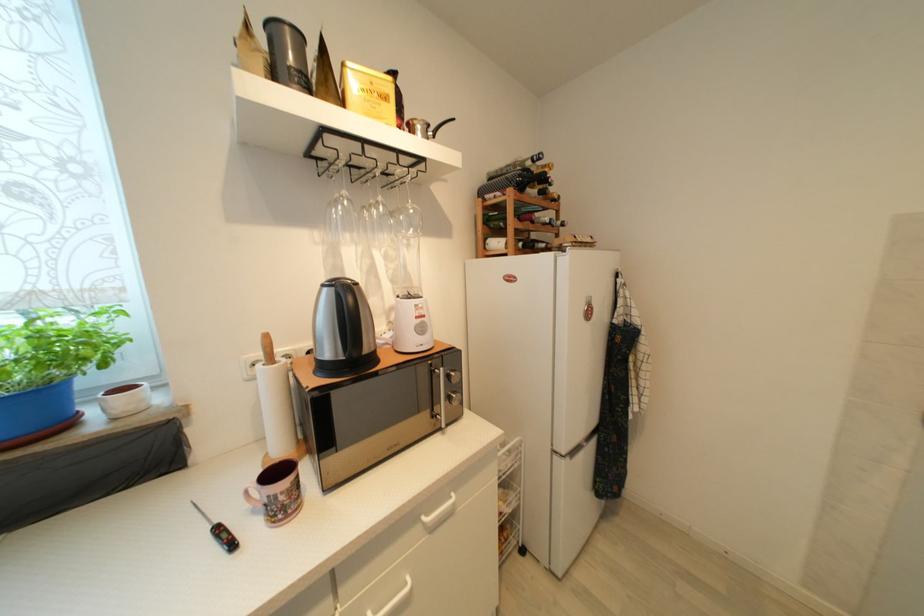
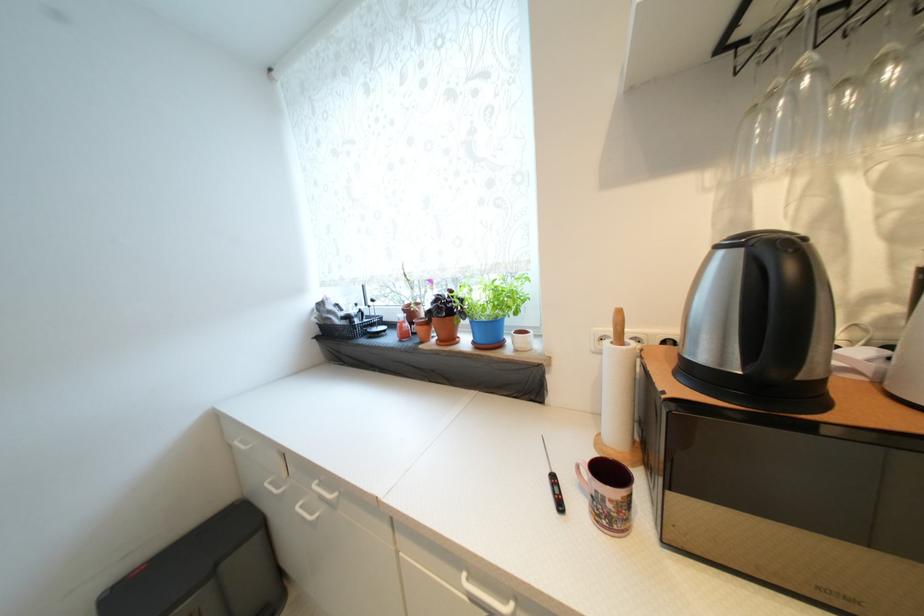
The point at (286, 500) is marked in the first image. Where is the corresponding point in the second image?

(614, 508)